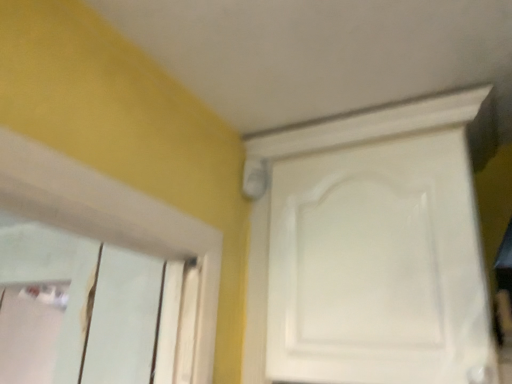
This screenshot has width=512, height=384. What do you see at coordinates (378, 266) in the screenshot? I see `white glossy door at upper center` at bounding box center [378, 266].

Measure the distance between white glossy door at upper center and camera.

The depth of white glossy door at upper center is 31.08 inches.

Where is `white glossy door at upper center`? white glossy door at upper center is located at coordinates (378, 266).

Locate an element on the screen. The height and width of the screenshot is (384, 512). white glossy door at upper center is located at coordinates (378, 266).